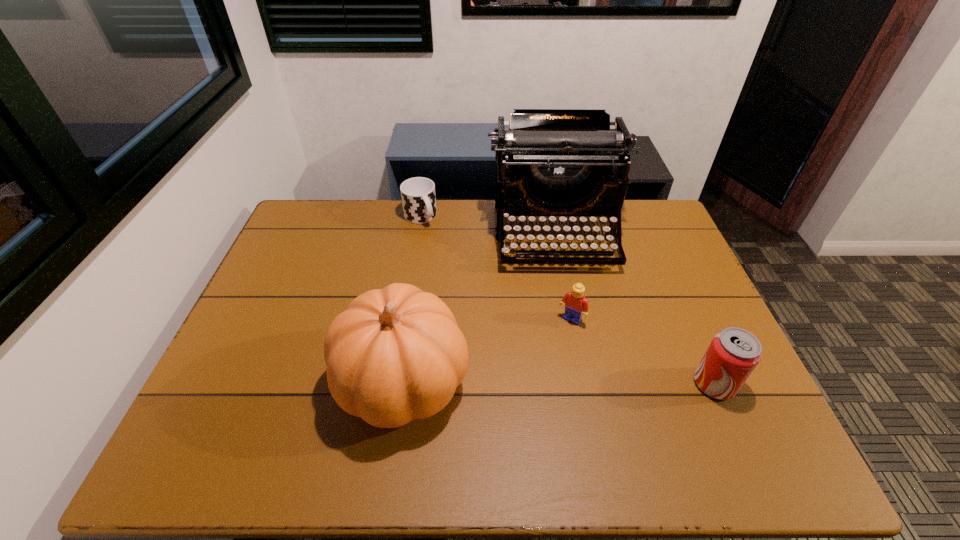
The image size is (960, 540). Find the location of `pumpkin`. pumpkin is located at coordinates (396, 354).

You are a GUI agent. You are given a task and a screenshot of the screen. Output one action in this format:
    pyautogui.click(x=<x>, y=<y>)
    Task: Click on the third tallest object
    Image resolution: width=960 pixels, height=540 pixels.
    Given the screenshot: What is the action you would take?
    pyautogui.click(x=734, y=353)

Identify the location of the rightmost object. [x=734, y=353].

Find the location of a particular element. cup is located at coordinates (418, 195).

Locate an element on the screen. This screenshot has width=960, height=540. the third nearest object is located at coordinates (576, 305).

At what (x,y) coordinates should I click in order to perform the action: click on the tallest object. Please return your answer as a coordinate pair (x, y). Looking at the image, I should click on (551, 162).

Locate an element on the screen. free spot located 0.090m on the right of the pumpkin is located at coordinates (506, 382).

This screenshot has width=960, height=540. Identify the location of blank area located on the left of the third shortest object. (595, 383).

Image resolution: width=960 pixels, height=540 pixels. Find the location of `vacant area situated on the side of the cup with the handle`. vacant area situated on the side of the cup with the handle is located at coordinates (468, 281).

Find the location of a particular element. vacant space located on the side of the cup with the handle is located at coordinates (448, 256).